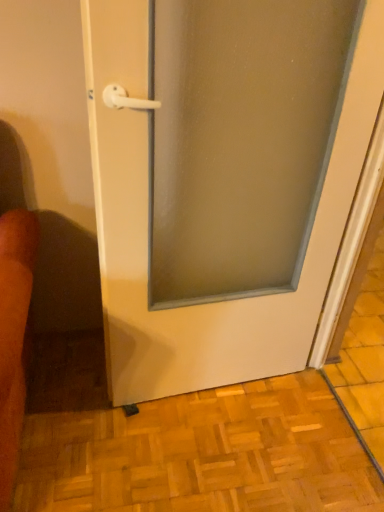
This screenshot has width=384, height=512. What do you see at coordinates (223, 178) in the screenshot?
I see `white glossy door at center` at bounding box center [223, 178].

In order to face white glossy door at center, should I rotate leftwards or rightwards?

You should rotate right by 6.601 degrees.

This screenshot has width=384, height=512. I want to click on white glossy door at center, so click(223, 178).

In order to face wooden parquet floor at lower center, should I rotate leftwards or rightwards?

Rotate left and turn 0.231 degrees.

What is the approximate height of wooden parquet floor at lower center?

The height of wooden parquet floor at lower center is 2.05 inches.

This screenshot has height=512, width=384. Describe the element at coordinates (202, 454) in the screenshot. I see `wooden parquet floor at lower center` at that location.

Identify the location of wooden parquet floor at lower center. (202, 454).

What is the approximate width of wooden parquet floor at lower center?

4.19 feet.

Locate an element on the screen. The image size is (384, 512). white glossy door at center is located at coordinates (223, 178).

Which is more to the right, wooden parquet floor at lower center or white glossy door at center?

white glossy door at center.

Which object is closer to the camera, wooden parquet floor at lower center or white glossy door at center?

white glossy door at center is in front.

Which is more distant, (141, 464) or (359, 123)?

Positioned behind is point (141, 464).

From the image's perspective, which object appears higher, wooden parquet floor at lower center or white glossy door at center?

white glossy door at center.

From a real-world perspective, is wooden parquet floor at lower center on white glossy door at center?

No, from a real-world perspective, wooden parquet floor at lower center is not above white glossy door at center.

Which object is thinner, wooden parquet floor at lower center or white glossy door at center?

white glossy door at center is thinner.

Can you confirm if wooden parquet floor at lower center is taller than white glossy door at center?

No.

Which of these two, wooden parquet floor at lower center or white glossy door at center, is smaller?

wooden parquet floor at lower center is smaller.

Is wooden parquet floor at lower center spatially inside white glossy door at center, or outside of it?

wooden parquet floor at lower center cannot be found inside white glossy door at center.

Are wooden parquet floor at lower center and white glossy door at center far apart?

Actually, wooden parquet floor at lower center and white glossy door at center are a little close together.

Is white glossy door at center at the back of wooden parquet floor at lower center?

wooden parquet floor at lower center is not turned away from white glossy door at center.

What's the angular difference between wooden parquet floor at lower center and white glossy door at center's facing directions?

The angle between the facing direction of wooden parquet floor at lower center and the facing direction of white glossy door at center is 85.7 degrees.

You are a GUI agent. You are given a task and a screenshot of the screen. Output one action in this format:
    pyautogui.click(x=<x>, y=<y>)
    Task: Click on the door above the wooden parquet floor at lower center (from a real-world perspective)
    
    Given the screenshot: What is the action you would take?
    pyautogui.click(x=223, y=178)

Which object is positioned more to the left, white glossy door at center or wooden parquet floor at lower center?

From the viewer's perspective, wooden parquet floor at lower center appears more on the left side.

Relative to wooden parquet floor at lower center, is white glossy door at center in front or behind?

Visually, white glossy door at center is located in front of wooden parquet floor at lower center.

Is point (293, 214) closer to viewer compared to point (50, 443)?

That is True.

From the image's perspective, which object appears higher, white glossy door at center or wooden parquet floor at lower center?

From the image's view, white glossy door at center is above.

From a real-world perspective, is white glossy door at center physically below wooden parquet floor at lower center?

No, from a real-world perspective, white glossy door at center is not under wooden parquet floor at lower center.

Which of these two, white glossy door at center or wooden parquet floor at lower center, is wider?

wooden parquet floor at lower center.

Can you confirm if white glossy door at center is shorter than wooden parquet floor at lower center?

No, white glossy door at center is not shorter than wooden parquet floor at lower center.

In the scene shown: Between white glossy door at center and wooden parquet floor at lower center, which one has smaller size?

Smaller between the two is wooden parquet floor at lower center.

Is wooden parquet floor at lower center inside white glossy door at center?

No, white glossy door at center does not contain wooden parquet floor at lower center.

Is white glossy door at center not close to wooden parquet floor at lower center?

white glossy door at center is actually quite close to wooden parquet floor at lower center.

Does white glossy door at center turn towards wooden parquet floor at lower center?

No, white glossy door at center is not facing towards wooden parquet floor at lower center.

What's the angular difference between white glossy door at center and wooden parquet floor at lower center's facing directions?

They differ by 85.7 degrees in their facing directions.

This screenshot has height=512, width=384. Find the location of `tile located below the white glossy door at center (from the image's perspective)`. tile located below the white glossy door at center (from the image's perspective) is located at coordinates (202, 454).

Locate an element on the screen. Image resolution: width=384 pixels, height=512 pixels. tile below the white glossy door at center (from the image's perspective) is located at coordinates (202, 454).

What are the coordinates of `door on the right of wooden parquet floor at lower center` in the screenshot? It's located at (223, 178).